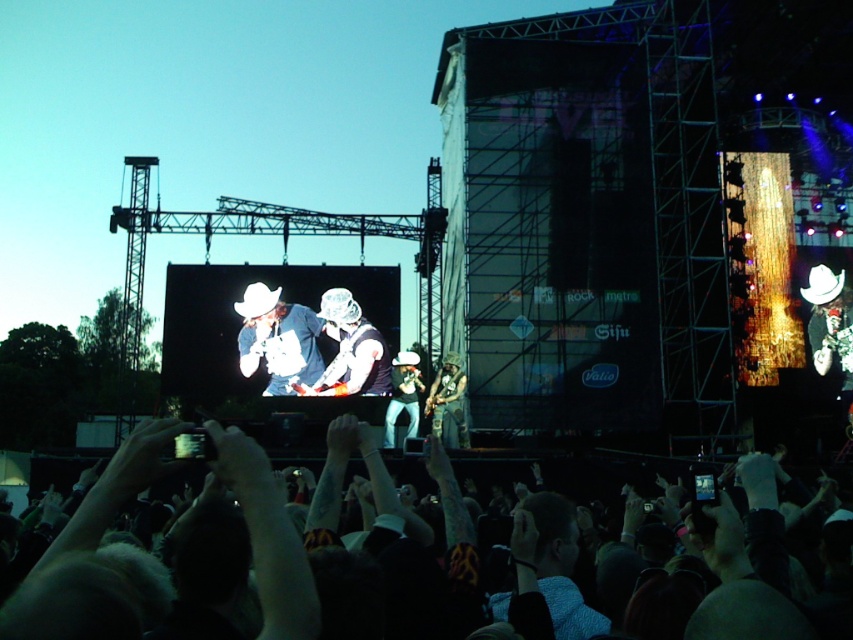
Question: Is dark skin crowd at lower center above black matte vest at center?

Choices:
 (A) no
 (B) yes

Answer: (A)

Question: Which point is closer to the camera?

Choices:
 (A) black matte vest at center
 (B) dark skin crowd at lower center
 (C) matte white cowboy hat at center
 (D) camouflage fabric guitar at center

Answer: (B)

Question: Can you confirm if camouflage fabric guitar at center is bigger than shiny silver guitar at center?

Choices:
 (A) yes
 (B) no

Answer: (B)

Question: Which object is the closest to the camouflage fabric guitar at center?

Choices:
 (A) shiny silver guitar at center
 (B) matte white cowboy hat at center

Answer: (A)

Question: Is matte white cowboy hat at center thinner than shiny silver guitar at center?

Choices:
 (A) no
 (B) yes

Answer: (A)

Question: Which of the following is the closest to the observer?

Choices:
 (A) camouflage fabric guitar at center
 (B) shiny silver guitar at center
 (C) dark skin crowd at lower center

Answer: (C)